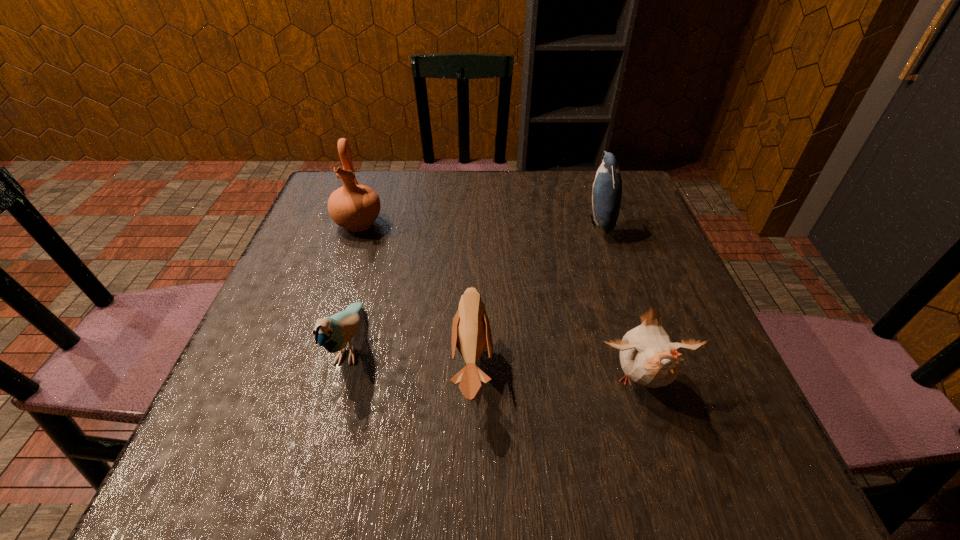
At what (x,y) coordinates should I click in order to perform the action: click on the third closest object to the shortest object. Please return your answer as a coordinate pair (x, y). This screenshot has height=540, width=960. Looking at the image, I should click on (355, 207).

At what (x,y) coordinates should I click in order to perform the action: click on bird that stands as the third closest to the farthest bird. Please return your answer as a coordinate pair (x, y). The image size is (960, 540). Looking at the image, I should click on (333, 333).

Find the location of a particular element. Image resolution: width=960 pixels, height=540 pixels. the third closest bird to the leftmost bird is located at coordinates (607, 188).

This screenshot has height=540, width=960. What are the coordinates of `vacant space that satisfies the following two spatial constraints: 1. at the tip of the farthest bird's beak; 2. on the spout of the pottery` in the screenshot? It's located at (599, 224).